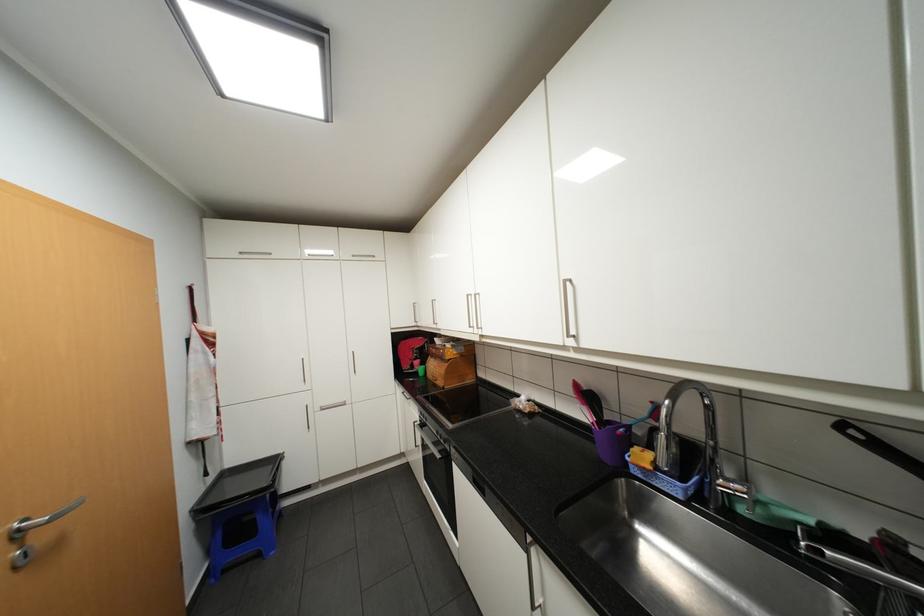
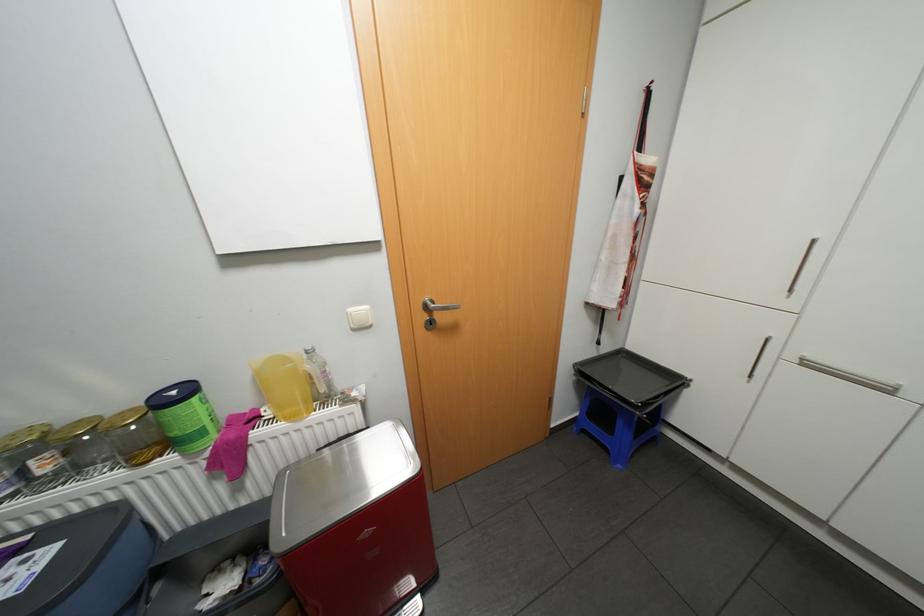
Where in the second image is the point corresponding to [283,460] from the first image?

(684, 379)